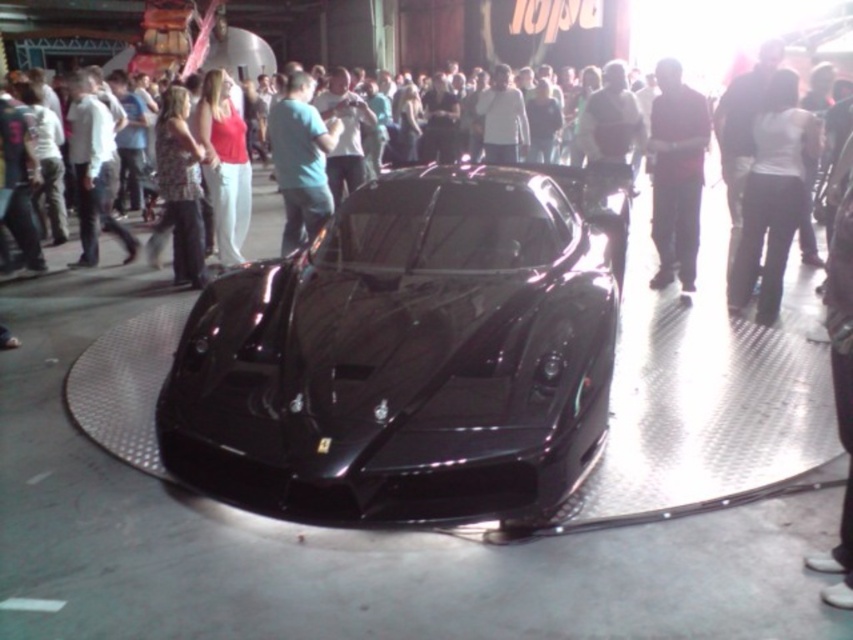
Question: Which object appears closest to the camera in this image?

Choices:
 (A) matte red shirt at center
 (B) white matte shirt at upper center

Answer: (B)

Question: Which is nearer to the dark red shirt at center?

Choices:
 (A) matte blue shirt at center
 (B) matte red shirt at center

Answer: (A)

Question: Is glossy black car at center thinner than dark red shirt at center?

Choices:
 (A) no
 (B) yes

Answer: (A)

Question: Is white matte shirt at upper center positioned before dark red shirt at center?

Choices:
 (A) no
 (B) yes

Answer: (B)

Question: Among these points, which one is farthest from the camera?

Choices:
 (A) [660, 128]
 (B) [514, 444]
 (C) [289, 209]
 (D) [772, 104]

Answer: (C)

Question: Is dark red shirt at center to the left of floral-patterned blouse at center from the viewer's perspective?

Choices:
 (A) yes
 (B) no

Answer: (B)